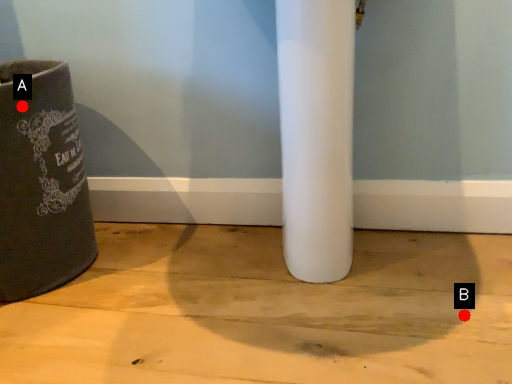
Question: Two points are circled on the image, labeled by A and B beside each circle. Among these points, which one is nearest to the camera?

Choices:
 (A) A is closer
 (B) B is closer

Answer: (B)